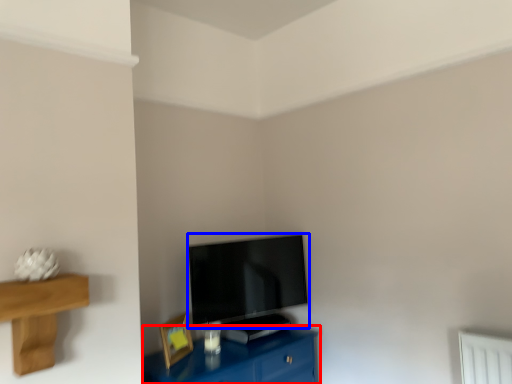
Question: Which point is closer to the camera, table (highlighted by a red box) or television (highlighted by a blue box)?

Choices:
 (A) table
 (B) television

Answer: (A)